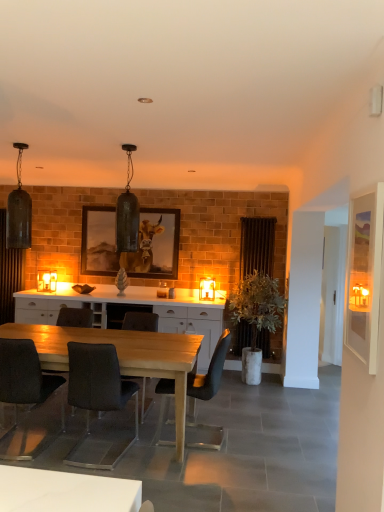
What is the approximate height of dark gray fabric chair at center, marked as the second chair in a left-to-right arrangement?

The height of dark gray fabric chair at center, marked as the second chair in a left-to-right arrangement, is 36.65 inches.

Locate an element on the screen. matte glass candle at center, which is the first lamp from back to front is located at coordinates (x=46, y=281).

This screenshot has height=512, width=384. What do you see at coordinates (46, 281) in the screenshot? I see `matte glass candle at center, which is counted as the 1th lamp, starting from the left` at bounding box center [46, 281].

Describe the element at coordinates (9, 273) in the screenshot. I see `metallic silver curtain at left, the 2th curtain viewed from the right` at that location.

Describe the element at coordinates (207, 289) in the screenshot. I see `translucent glass candle at center, marked as the 2th lamp in a back-to-front arrangement` at that location.

This screenshot has width=384, height=512. What do you see at coordinates (131, 251) in the screenshot? I see `wooden framed picture of cow at center` at bounding box center [131, 251].

Find the location of a particular element. The width and height of the screenshot is (384, 512). light wood table at center is located at coordinates (122, 356).

Is dark gray fabric chair at lower left, which ranks as the first chair in left-to-right order, placed right next to matte black pendant light at upper left, marked as the third lamp in a right-to-left arrangement?

No.

Can you tell me how much dark gray fabric chair at lower left, which appears as the 4th chair when viewed from the right, and matte black pendant light at upper left, the 2th lamp viewed from the front, differ in facing direction?

The angle between the facing direction of dark gray fabric chair at lower left, which appears as the 4th chair when viewed from the right, and the facing direction of matte black pendant light at upper left, the 2th lamp viewed from the front, is 178 degrees.

In terms of height, does dark gray fabric chair at lower left, which ranks as the first chair in left-to-right order, look taller or shorter compared to matte black pendant light at upper left, the 2th lamp viewed from the front?

In the image, dark gray fabric chair at lower left, which ranks as the first chair in left-to-right order, appears to be shorter than matte black pendant light at upper left, the 2th lamp viewed from the front.

From a real-world perspective, which object stands above the other?

matte black pendant light at upper left, the second lamp when ordered from left to right, from a real-world perspective.

Identify the location of desk located in front of the brown wooden radiator at right, which ranks as the second curtain in left-to-right order. Image resolution: width=384 pixels, height=512 pixels. (122, 356).

Considering the points (245, 233) and (68, 330), which point is behind, point (245, 233) or point (68, 330)?

The point (245, 233) is behind.

Is brown wooden radiator at right, the first curtain in the front-to-back sequence, inside or outside of light wood table at center?

The correct answer is: outside.

How much distance is there between dark gray fabric chair at center, marked as the second chair in a right-to-left arrangement, and matte black chair at center, which is the 1th chair in right-to-left order?

A distance of 88.40 centimeters exists between dark gray fabric chair at center, marked as the second chair in a right-to-left arrangement, and matte black chair at center, which is the 1th chair in right-to-left order.

Which is behind, point (155, 325) or point (215, 391)?

Point (215, 391)

From the image's perspective, is dark gray fabric chair at center, marked as the second chair in a right-to-left arrangement, beneath matte black chair at center, which is the 1th chair in right-to-left order?

No, from the image's perspective, dark gray fabric chair at center, marked as the second chair in a right-to-left arrangement, is not beneath matte black chair at center, which is the 1th chair in right-to-left order.

Based on the photo, is dark gray fabric chair at center, marked as the 3th chair in a left-to-right arrangement, bigger than matte black chair at center, positioned as the 4th chair in left-to-right order?

No.

Based on the photo, which object is closer to the camera taking this photo, wooden framed picture of cow at center or dark gray fabric chair at center, the 3th chair viewed from the right?

dark gray fabric chair at center, the 3th chair viewed from the right.

Does wooden framed picture of cow at center have a greater width compared to dark gray fabric chair at center, marked as the second chair in a left-to-right arrangement?

Incorrect, the width of wooden framed picture of cow at center does not surpass that of dark gray fabric chair at center, marked as the second chair in a left-to-right arrangement.

Can you confirm if dark gray fabric chair at lower left, which ranks as the first chair in left-to-right order, is shorter than metallic silver curtain at left, the 1th curtain viewed from the left?

Yes, dark gray fabric chair at lower left, which ranks as the first chair in left-to-right order, is shorter than metallic silver curtain at left, the 1th curtain viewed from the left.

Is dark gray fabric chair at lower left, which ranks as the first chair in left-to-right order, not near metallic silver curtain at left, the 1th curtain viewed from the back?

dark gray fabric chair at lower left, which ranks as the first chair in left-to-right order, is far away from metallic silver curtain at left, the 1th curtain viewed from the back.

Is dark gray fabric chair at lower left, which ranks as the first chair in left-to-right order, wider or thinner than metallic silver curtain at left, the 2th curtain viewed from the front?

In the image, dark gray fabric chair at lower left, which ranks as the first chair in left-to-right order, appears to be wider than metallic silver curtain at left, the 2th curtain viewed from the front.

Which of these two, dark gray fabric chair at lower left, which appears as the 4th chair when viewed from the right, or metallic silver curtain at left, the 2th curtain viewed from the front, is smaller?

metallic silver curtain at left, the 2th curtain viewed from the front, is smaller.

Relative to matte black pendant light at upper left, marked as the third lamp in a right-to-left arrangement, is green leafy plant in white pot at center-right in front or behind?

Visually, green leafy plant in white pot at center-right is located behind matte black pendant light at upper left, marked as the third lamp in a right-to-left arrangement.

Which object is thinner, green leafy plant in white pot at center-right or matte black pendant light at upper left, the second lamp when ordered from left to right?

matte black pendant light at upper left, the second lamp when ordered from left to right.

From the image's perspective, is green leafy plant in white pot at center-right positioned above or below matte black pendant light at upper left, the 2th lamp viewed from the front?

green leafy plant in white pot at center-right is situated lower than matte black pendant light at upper left, the 2th lamp viewed from the front, in the image.

The width and height of the screenshot is (384, 512). I want to click on picture frame above the white glossy cabinet at center (from a real-world perspective), so click(x=131, y=251).

Is white glossy cabinet at center thinner than wooden framed picture of cow at center?

Incorrect, the width of white glossy cabinet at center is not less than that of wooden framed picture of cow at center.

Is white glossy cabinet at center facing away from wooden framed picture of cow at center?

No, wooden framed picture of cow at center is not at the back of white glossy cabinet at center.

Is white glossy cabinet at center to the right of wooden framed picture of cow at center from the viewer's perspective?

Correct, you'll find white glossy cabinet at center to the right of wooden framed picture of cow at center.

The width and height of the screenshot is (384, 512). I want to click on the 1st lamp counting from the left side of the dark gray fabric chair at lower left, which ranks as the first chair in left-to-right order, so click(x=19, y=211).

Where is `desk directly beneath the brown wooden radiator at right, the second curtain viewed from the back (from a real-world perspective)`? desk directly beneath the brown wooden radiator at right, the second curtain viewed from the back (from a real-world perspective) is located at coordinates (122, 356).

When comparing their distances from dark gray fabric chair at lower left, which ranks as the first chair in left-to-right order, does light wood table at center or translucent glass candle at center, marked as the first lamp in a right-to-left arrangement, seem closer?

The object closer to dark gray fabric chair at lower left, which ranks as the first chair in left-to-right order, is light wood table at center.

Considering their positions, is metallic silver curtain at left, the 2th curtain viewed from the front, positioned further to metallic glass pendant light at center, which appears as the second lamp when viewed from the right, than wooden framed picture of cow at center?

The object further to metallic glass pendant light at center, which appears as the second lamp when viewed from the right, is metallic silver curtain at left, the 2th curtain viewed from the front.

Based on their spatial positions, is dark gray fabric chair at center, marked as the second chair in a right-to-left arrangement, or dark gray fabric chair at lower left, which appears as the 4th chair when viewed from the right, closer to matte black chair at center, which is the 1th chair in right-to-left order?

The object closer to matte black chair at center, which is the 1th chair in right-to-left order, is dark gray fabric chair at center, marked as the second chair in a right-to-left arrangement.

When comparing their distances from green leafy plant in white pot at center-right, does translucent glass candle at center, marked as the first lamp in a right-to-left arrangement, or dark gray fabric chair at lower left, which ranks as the first chair in left-to-right order, seem further?

Based on the image, dark gray fabric chair at lower left, which ranks as the first chair in left-to-right order, appears to be further to green leafy plant in white pot at center-right.

Estimate the real-world distances between objects in this image. Which object is further from metallic glass pendant light at center, arranged as the 3th lamp when viewed from the left, dark gray fabric chair at center, marked as the second chair in a right-to-left arrangement, or white glossy cabinet at center?

Based on the image, white glossy cabinet at center appears to be further to metallic glass pendant light at center, arranged as the 3th lamp when viewed from the left.

In the scene shown: Considering their positions, is dark gray fabric chair at center, marked as the 3th chair in a left-to-right arrangement, positioned closer to matte glass candle at center, arranged as the fourth lamp when viewed from the right, than dark gray fabric chair at center, marked as the second chair in a left-to-right arrangement?

The object closer to matte glass candle at center, arranged as the fourth lamp when viewed from the right, is dark gray fabric chair at center, marked as the 3th chair in a left-to-right arrangement.

Considering their positions, is green leafy plant in white pot at center-right positioned further to dark gray fabric chair at center, the 3th chair viewed from the right, than metallic silver curtain at left, the 2th curtain viewed from the right?

Based on the image, green leafy plant in white pot at center-right appears to be further to dark gray fabric chair at center, the 3th chair viewed from the right.

Consider the image. Estimate the real-world distances between objects in this image. Which object is closer to matte black pendant light at upper left, marked as the third lamp in a right-to-left arrangement, light wood table at center or green leafy plant in white pot at center-right?

light wood table at center.

This screenshot has width=384, height=512. I want to click on cabinetry between matte glass candle at center, which is counted as the 1th lamp, starting from the left, and brown wooden radiator at right, the first curtain in the front-to-back sequence, from left to right, so click(x=192, y=328).

In order to click on cabinetry between dark gray fabric chair at center, marked as the second chair in a left-to-right arrangement, and brown wooden radiator at right, which ranks as the second curtain in left-to-right order, from front to back in this screenshot , I will do `click(192, 328)`.

I want to click on cabinetry between light wood table at center and brown wooden radiator at right, which ranks as the 1th curtain in right-to-left order, in the front-back direction, so click(x=192, y=328).

At what (x,y) coordinates should I click in order to perform the action: click on cabinetry situated between matte glass candle at center, which is the first lamp from back to front, and translucent glass candle at center, marked as the 2th lamp in a back-to-front arrangement, from left to right. Please return your answer as a coordinate pair (x, y). This screenshot has width=384, height=512. Looking at the image, I should click on (192, 328).